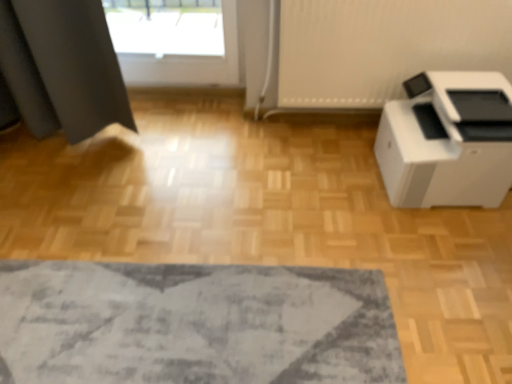
This screenshot has height=384, width=512. I want to click on vacant area that lies between white plastic printer at right and textured gray rug at lower center, so click(309, 231).